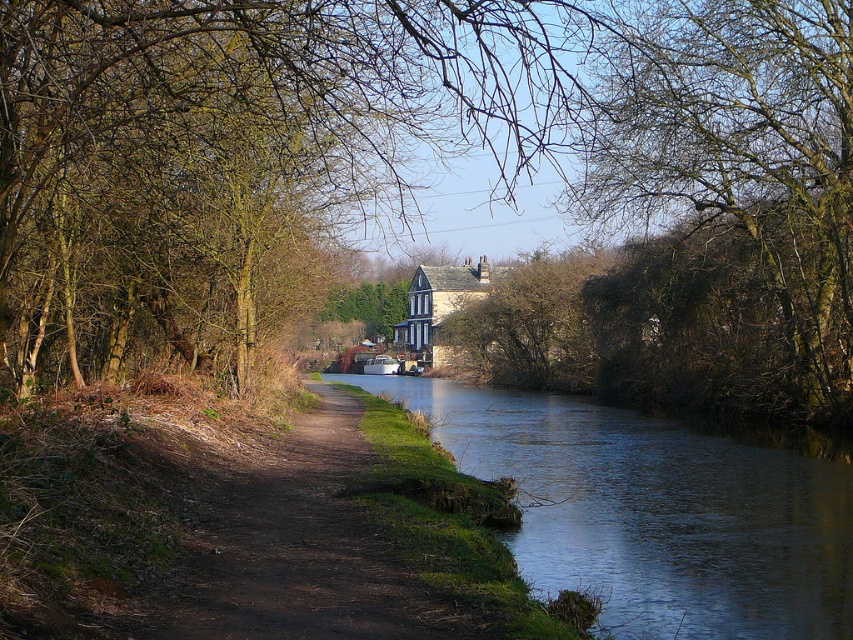
Is point (73, 330) closer to viewer compared to point (305, 445)?

No, it is not.

Can you confirm if bare branches at center is taller than brown dirt path at center?

Yes, bare branches at center is taller than brown dirt path at center.

Between point (175, 346) and point (294, 422), which one is positioned in front?

Point (175, 346) is more forward.

Image resolution: width=853 pixels, height=640 pixels. Find the location of `bare branches at center`. bare branches at center is located at coordinates (241, 154).

Who is lower down, bare branches at center or bare branches at upper center?

Positioned lower is bare branches at upper center.

Is bare branches at center taller than bare branches at upper center?

Yes, bare branches at center is taller than bare branches at upper center.

Between point (16, 118) and point (706, 269), which one is positioned in front?

Point (16, 118)

Where is `bare branches at center`? This screenshot has height=640, width=853. bare branches at center is located at coordinates (241, 154).

Between bare branches at upper center and dark blue water at center, which one is positioned higher?

bare branches at upper center is higher up.

Find the location of a particular element. Image resolution: width=853 pixels, height=640 pixels. bare branches at upper center is located at coordinates (733, 204).